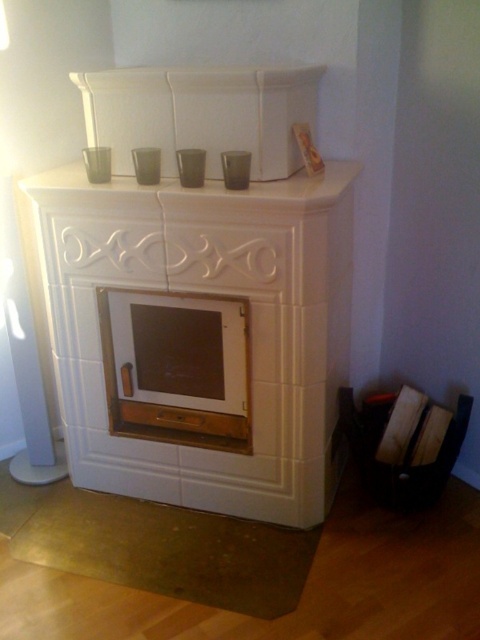
You are a delivery person who needs to place a 30 cm wide package between the white glossy mantle at upper center and the wooden frame at upper center. Can you fit the package in the space between them?

The distance between the white glossy mantle at upper center and the wooden frame at upper center is 28.99 centimeters, so the 30 cm wide package cannot fit in the space between them.

You are designing a shelf that needs to fit both the white glossy fireplace at center and the white glossy mantle at upper center. Which one requires a wider shelf space?

The white glossy mantle at upper center requires a wider shelf space because its width is greater than the white glossy fireplace at center.

You are designing a living room layout and need to place a large sofa. The white glossy fireplace at center and wooden fireplace at center are both in the same room. Which fireplace should you place the sofa closer to if you want the sofa to be near the larger one?

The white glossy fireplace at center is bigger than the wooden fireplace at center, so you should place the sofa closer to the white glossy fireplace at center.